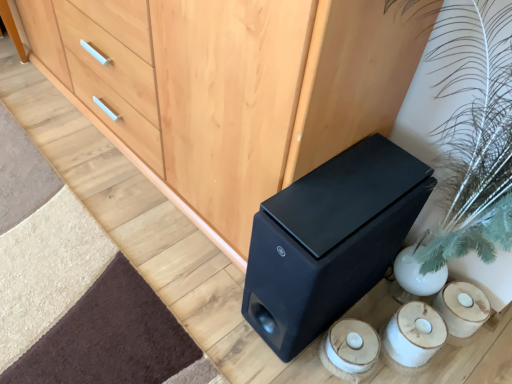
Question: Is the position of matte wood chest of drawers at center less distant than that of white ceramic candle holder at lower right?

Choices:
 (A) no
 (B) yes

Answer: (B)

Question: From a real-world perspective, is matte wood chest of drawers at center positioned over white ceramic candle holder at lower right based on gravity?

Choices:
 (A) yes
 (B) no

Answer: (A)

Question: From the image's perspective, is matte wood chest of drawers at center located above white ceramic candle holder at lower right?

Choices:
 (A) yes
 (B) no

Answer: (A)

Question: From the image's perspective, does matte wood chest of drawers at center appear lower than white ceramic candle holder at lower right?

Choices:
 (A) yes
 (B) no

Answer: (B)

Question: Can you confirm if matte wood chest of drawers at center is wider than white ceramic candle holder at lower right?

Choices:
 (A) yes
 (B) no

Answer: (A)

Question: Does matte wood chest of drawers at center appear on the left side of white ceramic candle holder at lower right?

Choices:
 (A) yes
 (B) no

Answer: (A)

Question: Could matte wood chest of drawers at center be considered to be inside white ceramic candle holder at lower right?

Choices:
 (A) no
 (B) yes

Answer: (A)

Question: Is white ceramic candle holder at lower right smaller than matte wood chest of drawers at center?

Choices:
 (A) no
 (B) yes

Answer: (B)

Question: Is white ceramic candle holder at lower right next to matte wood chest of drawers at center?

Choices:
 (A) yes
 (B) no

Answer: (B)

Question: Is white ceramic candle holder at lower right not inside matte wood chest of drawers at center?

Choices:
 (A) yes
 (B) no

Answer: (A)

Question: Can you confirm if white ceramic candle holder at lower right is positioned to the right of matte wood chest of drawers at center?

Choices:
 (A) yes
 (B) no

Answer: (A)

Question: Is white ceramic candle holder at lower right to the left of matte wood chest of drawers at center from the viewer's perspective?

Choices:
 (A) no
 (B) yes

Answer: (A)

Question: Does matte black speaker at lower right turn towards white ceramic candle holder at lower right?

Choices:
 (A) yes
 (B) no

Answer: (B)